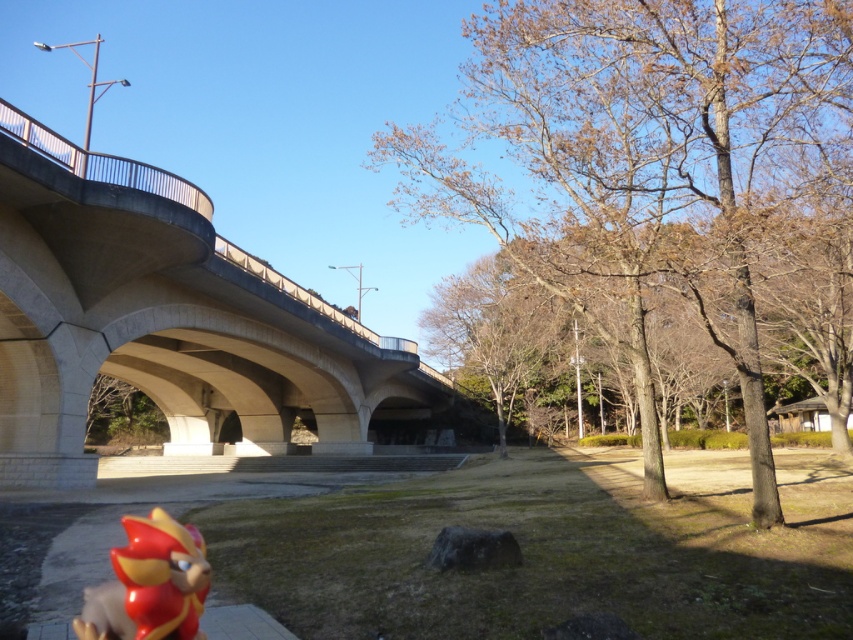
Question: Is concrete bridge at left thinner than shiny red plastic toy at lower left?

Choices:
 (A) no
 (B) yes

Answer: (A)

Question: Is concrete bridge at left to the left of shiny red plastic toy at lower left from the viewer's perspective?

Choices:
 (A) no
 (B) yes

Answer: (B)

Question: Can you confirm if bare wood tree at center is positioned below concrete bridge at left?

Choices:
 (A) no
 (B) yes

Answer: (A)

Question: Which point is farther from the camera taking this photo?

Choices:
 (A) (178, 550)
 (B) (616, 221)
 (C) (206, 444)

Answer: (C)

Question: Which object is positioned farthest from the bare wood tree at center?

Choices:
 (A) shiny red plastic toy at lower left
 (B) concrete bridge at left

Answer: (B)

Question: Which object appears farthest from the camera in this image?

Choices:
 (A) concrete bridge at left
 (B) shiny red plastic toy at lower left

Answer: (A)